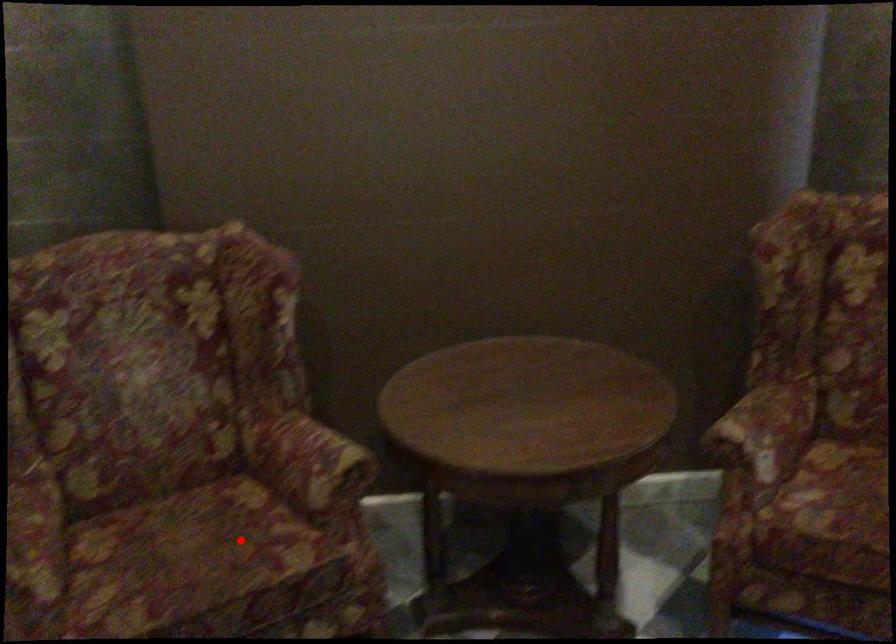
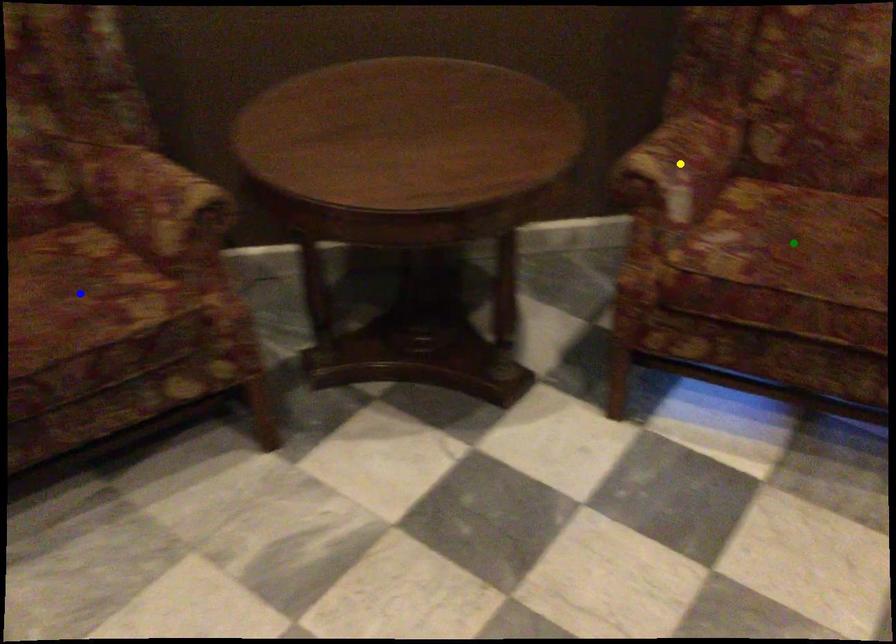
Question: I am providing you with two images of the same scene from different viewpoints. A red point is marked on the first image. You are given multiple points on the second image. Which mark in image 2 goes with the point in image 1?

Choices:
 (A) green point
 (B) yellow point
 (C) blue point

Answer: (C)